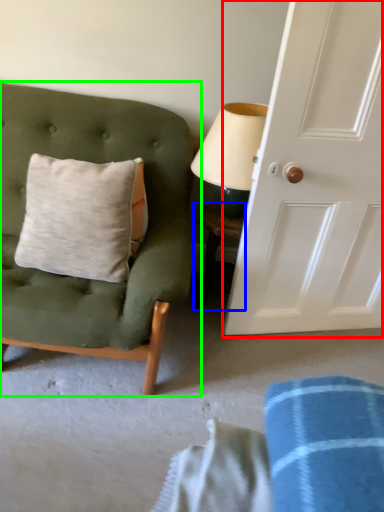
Question: Which object is the closest to the door (highlighted by a red box)? Choose among these: table (highlighted by a blue box) or chair (highlighted by a green box).

Choices:
 (A) table
 (B) chair

Answer: (A)